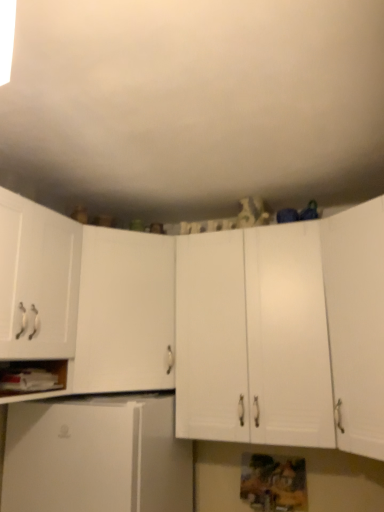
In order to face white matte cabinet at center, which is the second cabinetry in right-to-left order, should I rotate leftwards or rightwards?

A 8.280 degree turn to the right will do.

At what (x,y) coordinates should I click in order to perform the action: click on white matte cabinet at lower left. Please return your answer as a coordinate pair (x, y). This screenshot has height=512, width=384. Looking at the image, I should click on (36, 391).

Describe the element at coordinates (356, 324) in the screenshot. I see `white matte cabinet at right, marked as the 5th cabinetry in a left-to-right arrangement` at that location.

What do you see at coordinates (124, 312) in the screenshot? I see `white matte cabinet at left, which ranks as the 3th cabinetry in right-to-left order` at bounding box center [124, 312].

Image resolution: width=384 pixels, height=512 pixels. Find the location of `white matte cabinet at left, placed as the first cabinetry when sorted from left to right`. white matte cabinet at left, placed as the first cabinetry when sorted from left to right is located at coordinates (37, 280).

Is white matte cabinet at left, the third cabinetry from the left, inside white matte cabinet at lower left?

Actually, white matte cabinet at left, the third cabinetry from the left, is outside white matte cabinet at lower left.

Does white matte cabinet at lower left come in front of white matte cabinet at left, the third cabinetry from the left?

Yes, the depth of white matte cabinet at lower left is less than that of white matte cabinet at left, the third cabinetry from the left.

You are a GUI agent. You are given a task and a screenshot of the screen. Output one action in this format:
    pyautogui.click(x=<x>, y=<y>)
    Task: Click on the cabinet in front of the white matte cabinet at left, the third cabinetry from the left
    Image resolution: width=384 pixels, height=512 pixels.
    Given the screenshot: What is the action you would take?
    pyautogui.click(x=36, y=391)

Considering the points (55, 365) and (89, 340), which point is behind, point (55, 365) or point (89, 340)?

The point (89, 340) is more distant.

Is white matte cabinet at lower left placed right next to white matte refrigerator at lower left, marked as the 2th cabinetry in a left-to-right arrangement?

They are not placed beside each other.

From the image's perspective, is white matte cabinet at lower left located above or below white matte refrigerator at lower left, marked as the 2th cabinetry in a left-to-right arrangement?

Based on their image positions, white matte cabinet at lower left is located above white matte refrigerator at lower left, marked as the 2th cabinetry in a left-to-right arrangement.

Considering the positions of points (37, 391) and (87, 495), is point (37, 391) farther from camera compared to point (87, 495)?

Yes, it is behind point (87, 495).

Considering the relative sizes of white matte refrigerator at lower left, which is counted as the fourth cabinetry, starting from the right, and white matte cabinet at center, the fourth cabinetry viewed from the left, in the image provided, is white matte refrigerator at lower left, which is counted as the fourth cabinetry, starting from the right, bigger than white matte cabinet at center, the fourth cabinetry viewed from the left,?

Correct, white matte refrigerator at lower left, which is counted as the fourth cabinetry, starting from the right, is larger in size than white matte cabinet at center, the fourth cabinetry viewed from the left.

Looking at this image, from the image's perspective, does white matte refrigerator at lower left, which is counted as the fourth cabinetry, starting from the right, appear higher than white matte cabinet at center, which is the second cabinetry in right-to-left order?

Incorrect, from the image's perspective, white matte refrigerator at lower left, which is counted as the fourth cabinetry, starting from the right, is lower than white matte cabinet at center, which is the second cabinetry in right-to-left order.

Are white matte refrigerator at lower left, marked as the 2th cabinetry in a left-to-right arrangement, and white matte cabinet at center, which is the second cabinetry in right-to-left order, making contact?

No, white matte refrigerator at lower left, marked as the 2th cabinetry in a left-to-right arrangement, is not with white matte cabinet at center, which is the second cabinetry in right-to-left order.

Consider the image. Is white matte refrigerator at lower left, marked as the 2th cabinetry in a left-to-right arrangement, oriented towards white matte cabinet at center, the fourth cabinetry viewed from the left?

No, white matte refrigerator at lower left, marked as the 2th cabinetry in a left-to-right arrangement, is not turned towards white matte cabinet at center, the fourth cabinetry viewed from the left.

Considering the sizes of white matte cabinet at center, the fourth cabinetry viewed from the left, and white matte refrigerator at lower left, which is counted as the fourth cabinetry, starting from the right, in the image, is white matte cabinet at center, the fourth cabinetry viewed from the left, bigger or smaller than white matte refrigerator at lower left, which is counted as the fourth cabinetry, starting from the right,?

In the image, white matte cabinet at center, the fourth cabinetry viewed from the left, appears to be smaller than white matte refrigerator at lower left, which is counted as the fourth cabinetry, starting from the right.

Is white matte cabinet at center, which is the second cabinetry in right-to-left order, not near white matte refrigerator at lower left, marked as the 2th cabinetry in a left-to-right arrangement?

No, white matte cabinet at center, which is the second cabinetry in right-to-left order, is in close proximity to white matte refrigerator at lower left, marked as the 2th cabinetry in a left-to-right arrangement.

Does white matte cabinet at center, the fourth cabinetry viewed from the left, have a greater width compared to white matte refrigerator at lower left, which is counted as the fourth cabinetry, starting from the right?

No, white matte cabinet at center, the fourth cabinetry viewed from the left, is not wider than white matte refrigerator at lower left, which is counted as the fourth cabinetry, starting from the right.

Between white matte cabinet at center, which is the second cabinetry in right-to-left order, and white matte refrigerator at lower left, marked as the 2th cabinetry in a left-to-right arrangement, which one appears on the right side from the viewer's perspective?

white matte cabinet at center, which is the second cabinetry in right-to-left order.

Considering the points (100, 479) and (24, 231), which point is behind, point (100, 479) or point (24, 231)?

The point (100, 479) is behind.

Is white matte refrigerator at lower left, marked as the 2th cabinetry in a left-to-right arrangement, positioned beyond the bounds of white matte cabinet at left, which is counted as the fifth cabinetry, starting from the right?

Indeed, white matte refrigerator at lower left, marked as the 2th cabinetry in a left-to-right arrangement, is completely outside white matte cabinet at left, which is counted as the fifth cabinetry, starting from the right.

Considering the relative sizes of white matte refrigerator at lower left, marked as the 2th cabinetry in a left-to-right arrangement, and white matte cabinet at left, which is counted as the fifth cabinetry, starting from the right, in the image provided, is white matte refrigerator at lower left, marked as the 2th cabinetry in a left-to-right arrangement, shorter than white matte cabinet at left, which is counted as the fifth cabinetry, starting from the right,?

Yes, white matte refrigerator at lower left, marked as the 2th cabinetry in a left-to-right arrangement, is shorter than white matte cabinet at left, which is counted as the fifth cabinetry, starting from the right.

Can you confirm if white matte refrigerator at lower left, which is counted as the fourth cabinetry, starting from the right, is bigger than white matte cabinet at left, placed as the first cabinetry when sorted from left to right?

Yes.

Does point (338, 304) come farther from viewer compared to point (26, 330)?

Yes, point (338, 304) is farther from viewer.

From the image's perspective, which object appears higher, white matte cabinet at right, marked as the 5th cabinetry in a left-to-right arrangement, or white matte cabinet at left, which is counted as the fifth cabinetry, starting from the right?

white matte cabinet at left, which is counted as the fifth cabinetry, starting from the right.

Is white matte cabinet at right, marked as the 5th cabinetry in a left-to-right arrangement, turned away from white matte cabinet at left, placed as the first cabinetry when sorted from left to right?

No, white matte cabinet at right, marked as the 5th cabinetry in a left-to-right arrangement, is not facing the opposite direction of white matte cabinet at left, placed as the first cabinetry when sorted from left to right.

Between white matte cabinet at right, which appears as the first cabinetry when viewed from the right, and white matte cabinet at left, which is counted as the fifth cabinetry, starting from the right, which one has smaller width?

With smaller width is white matte cabinet at left, which is counted as the fifth cabinetry, starting from the right.

From the picture: Is white matte cabinet at left, which is counted as the fifth cabinetry, starting from the right, at the back of white matte cabinet at lower left?

Correct, white matte cabinet at lower left is looking away from white matte cabinet at left, which is counted as the fifth cabinetry, starting from the right.

Is there a large distance between white matte cabinet at lower left and white matte cabinet at left, which is counted as the fifth cabinetry, starting from the right?

No, there isn't a large distance between white matte cabinet at lower left and white matte cabinet at left, which is counted as the fifth cabinetry, starting from the right.

How many degrees apart are the facing directions of white matte cabinet at lower left and white matte cabinet at left, placed as the first cabinetry when sorted from left to right?

The facing directions of white matte cabinet at lower left and white matte cabinet at left, placed as the first cabinetry when sorted from left to right, are 2.43 degrees apart.

Identify the location of cabinet that appears on the left of white matte cabinet at left, which ranks as the 3th cabinetry in right-to-left order. The height and width of the screenshot is (512, 384). 36,391.

This screenshot has height=512, width=384. Identify the location of cabinet above the white matte refrigerator at lower left, which is counted as the fourth cabinetry, starting from the right (from a real-world perspective). (36, 391).

Considering their positions, is white matte cabinet at lower left positioned further to white matte cabinet at left, which ranks as the 3th cabinetry in right-to-left order, than white matte cabinet at center, which is the second cabinetry in right-to-left order?

Based on the image, white matte cabinet at lower left appears to be further to white matte cabinet at left, which ranks as the 3th cabinetry in right-to-left order.

Considering their positions, is white matte refrigerator at lower left, marked as the 2th cabinetry in a left-to-right arrangement, positioned closer to white matte cabinet at left, which ranks as the 3th cabinetry in right-to-left order, than white matte cabinet at right, which appears as the first cabinetry when viewed from the right?

white matte refrigerator at lower left, marked as the 2th cabinetry in a left-to-right arrangement, lies closer to white matte cabinet at left, which ranks as the 3th cabinetry in right-to-left order, than the other object.

When comparing their distances from white matte cabinet at center, which is the second cabinetry in right-to-left order, does white matte cabinet at left, which is counted as the fifth cabinetry, starting from the right, or white matte refrigerator at lower left, which is counted as the fourth cabinetry, starting from the right, seem further?

Based on the image, white matte cabinet at left, which is counted as the fifth cabinetry, starting from the right, appears to be further to white matte cabinet at center, which is the second cabinetry in right-to-left order.

Looking at the image, which one is located closer to white matte cabinet at lower left, white matte cabinet at center, the fourth cabinetry viewed from the left, or white matte cabinet at left, the third cabinetry from the left?

Among the two, white matte cabinet at left, the third cabinetry from the left, is located nearer to white matte cabinet at lower left.

Which object lies further to the anchor point white matte cabinet at lower left, white matte cabinet at left, placed as the first cabinetry when sorted from left to right, or white matte cabinet at left, which ranks as the 3th cabinetry in right-to-left order?

white matte cabinet at left, which ranks as the 3th cabinetry in right-to-left order, is positioned further to the anchor white matte cabinet at lower left.

Which object lies further to the anchor point white matte refrigerator at lower left, marked as the 2th cabinetry in a left-to-right arrangement, white matte cabinet at left, which is counted as the fifth cabinetry, starting from the right, or white matte cabinet at lower left?

The object further to white matte refrigerator at lower left, marked as the 2th cabinetry in a left-to-right arrangement, is white matte cabinet at left, which is counted as the fifth cabinetry, starting from the right.

Considering their positions, is white matte cabinet at lower left positioned closer to white matte cabinet at right, which appears as the first cabinetry when viewed from the right, than white matte cabinet at left, which is counted as the fifth cabinetry, starting from the right?

white matte cabinet at left, which is counted as the fifth cabinetry, starting from the right.

Looking at the image, which one is located further to white matte cabinet at center, which is the second cabinetry in right-to-left order, white matte cabinet at left, which is counted as the fifth cabinetry, starting from the right, or white matte cabinet at lower left?

white matte cabinet at lower left.

You are a GUI agent. You are given a task and a screenshot of the screen. Output one action in this format:
    pyautogui.click(x=<x>, y=<y>)
    Task: Click on the cabinet between white matte cabinet at left, the third cabinetry from the left, and white matte refrigerator at lower left, marked as the 2th cabinetry in a left-to-right arrangement, vertically
    
    Given the screenshot: What is the action you would take?
    pyautogui.click(x=36, y=391)

Identify the location of cabinet located between white matte cabinet at left, which is counted as the fifth cabinetry, starting from the right, and white matte cabinet at center, the fourth cabinetry viewed from the left, in the left-right direction. (36, 391).

Locate an element on the screen. cabinet that lies between white matte cabinet at left, placed as the first cabinetry when sorted from left to right, and white matte refrigerator at lower left, which is counted as the fourth cabinetry, starting from the right, from top to bottom is located at coordinates (36, 391).

Locate an element on the screen. This screenshot has height=512, width=384. cabinet between white matte cabinet at left, placed as the first cabinetry when sorted from left to right, and white matte cabinet at right, which appears as the first cabinetry when viewed from the right, in the horizontal direction is located at coordinates (36, 391).